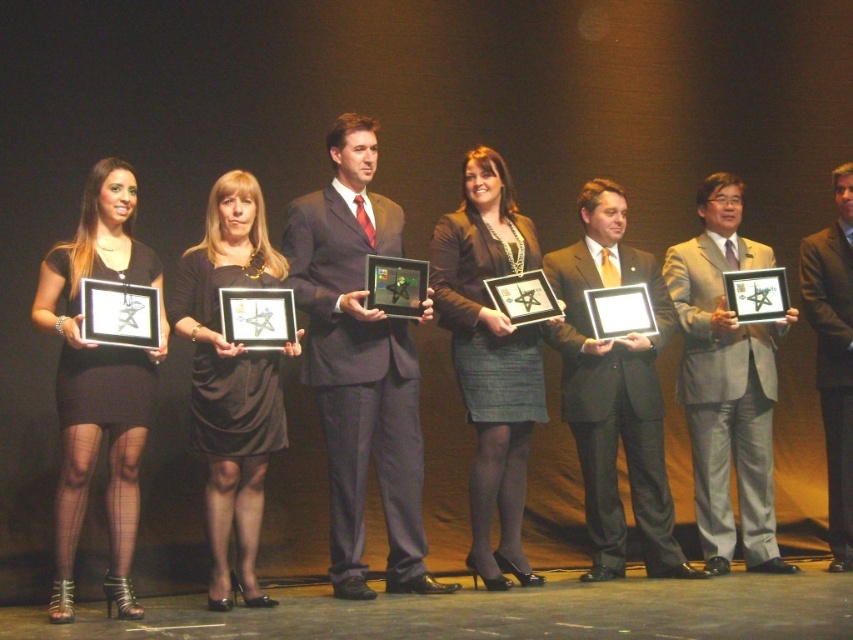
You are a photographer at an awards ceremony. You need to adjust the lighting so that the black matte dress at left and the gray suit at center are both well lit. Based on their positions, which object is closer to the floor and requires lower angle lighting?

The black matte dress at left is below gray suit at center, so the black matte dress at left is closer to the floor and requires lower angle lighting.